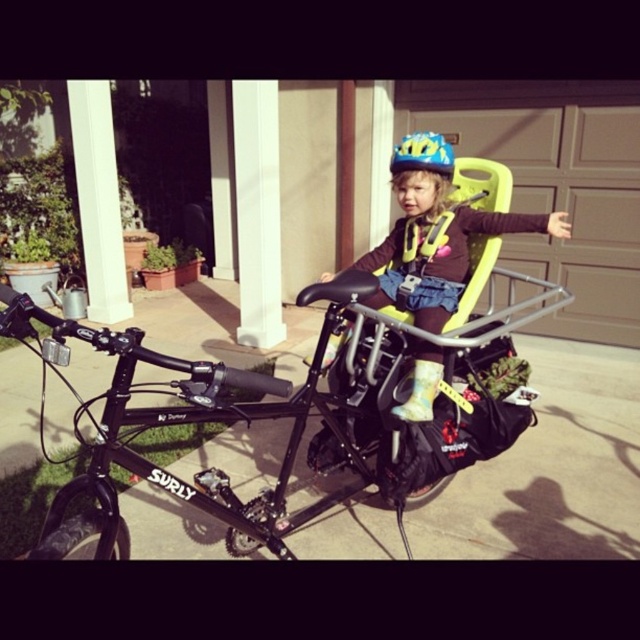
How much distance is there between matte yellow helmet at center and blue matte helmet at center?

matte yellow helmet at center is 16.64 inches away from blue matte helmet at center.

Does matte yellow helmet at center appear under blue matte helmet at center?

Yes, matte yellow helmet at center is below blue matte helmet at center.

Is point (506, 220) positioned before point (401, 161)?

No, (506, 220) is further to viewer.

This screenshot has width=640, height=640. Identify the location of matte yellow helmet at center. (438, 248).

Does point (296, 420) come behind point (397, 166)?

No.

Does black matte surly bike at center have a lesser width compared to blue matte helmet at center?

No, black matte surly bike at center is not thinner than blue matte helmet at center.

At what (x,y) coordinates should I click in order to perform the action: click on black matte surly bike at center. Please return your answer as a coordinate pair (x, y). This screenshot has width=640, height=640. Looking at the image, I should click on (278, 413).

Find the location of a particular element. The image size is (640, 640). black matte surly bike at center is located at coordinates (278, 413).

Between black matte surly bike at center and matte yellow helmet at center, which one appears on the left side from the viewer's perspective?

black matte surly bike at center is more to the left.

Can you confirm if black matte surly bike at center is positioned above matte yellow helmet at center?

No.

Does point (300, 406) come behind point (442, 307)?

No, it is not.

The height and width of the screenshot is (640, 640). What are the coordinates of `black matte surly bike at center` in the screenshot? It's located at (278, 413).